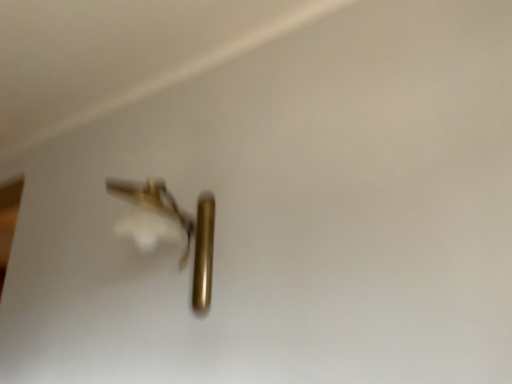
The width and height of the screenshot is (512, 384). Describe the element at coordinates (169, 229) in the screenshot. I see `gold metallic door handle at center` at that location.

In order to face gold metallic door handle at center, should I rotate leftwards or rightwards?

Turn left approximately 12.225 degrees to face it.

Identify the location of gold metallic door handle at center. coord(169,229).

Where is `gold metallic door handle at center`? Image resolution: width=512 pixels, height=384 pixels. gold metallic door handle at center is located at coordinates (169, 229).